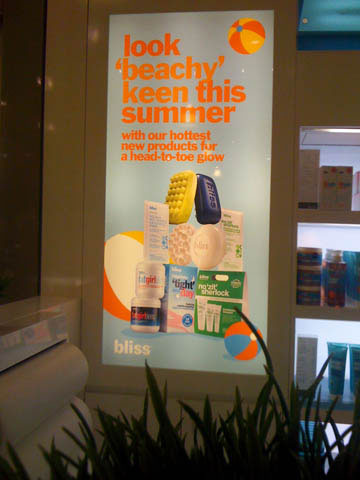
Where is `white frame around poster`? Image resolution: width=360 pixels, height=480 pixels. white frame around poster is located at coordinates (106, 10).